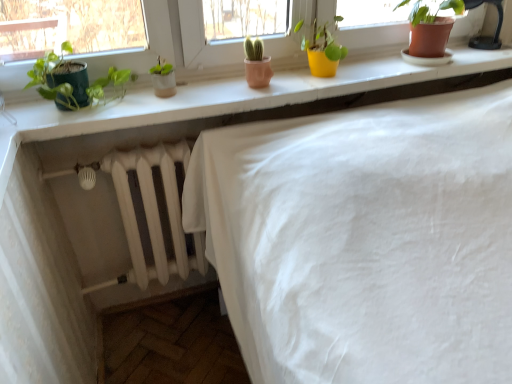
This screenshot has height=384, width=512. What are the coordinates of `vacant space that is in between green matte pot at left, the 1th houseplant in the left-to-right sequence, and yellow matte pot at upper center, which is the second houseplant in right-to-left order` in the screenshot? It's located at (221, 91).